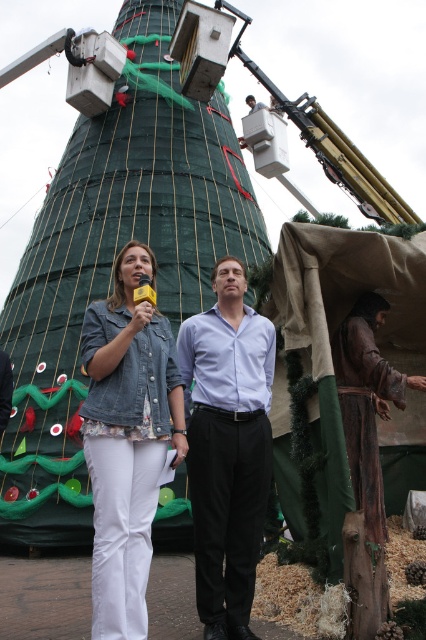
You are standing in front of the festive scene. You see the green netted tower at center and the brown leather robe at lower right. Which object is placed higher in the image?

The green netted tower at center is positioned over brown leather robe at lower right, so it is higher in the image.

You are standing in front of the festive scene and want to take a photo of the green netted tower at center and the denim jacket at center. Which object should you focus on first if you want to capture both in a single frame without moving the camera?

The green netted tower at center is above the denim jacket at center, so you should focus on the denim jacket at center first as it is closer to the camera. This way, both objects will be in the frame without needing to adjust the camera position.

You are a photographer standing in front of the green netted tower at center and the denim jacket at center. You want to capture a photo where both subjects are in focus. Which subject should you position closer to the camera to ensure both are in focus?

The green netted tower at center is wider than the denim jacket at center, so positioning the denim jacket at center closer to the camera will help keep both in focus as the wider subject can be farther back while still maintaining focus.